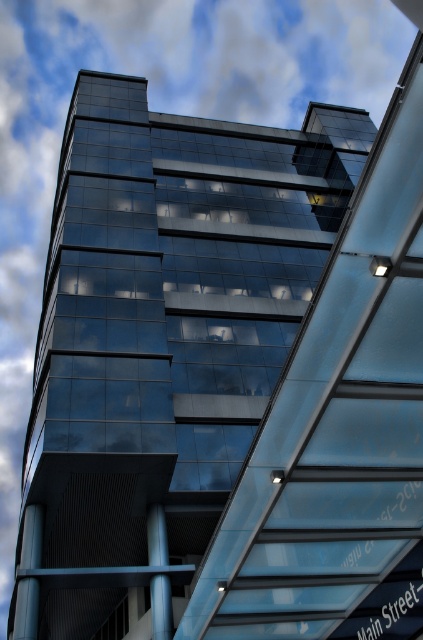
Between point (32, 506) and point (169, 593), which one is positioned behind?

The point (32, 506) is more distant.

Does point (21, 570) lie behind point (162, 573)?

No, (21, 570) is in front of (162, 573).

Between point (25, 611) and point (151, 556), which one is positioned in front?

Point (25, 611) is in front.

You are a GUI agent. You are given a task and a screenshot of the screen. Output one action in this format:
    pyautogui.click(x=<x>, y=<y>)
    Task: Click on the metallic gray pillar at lower left
    This screenshot has width=423, height=640.
    Given the screenshot: What is the action you would take?
    pos(25,609)